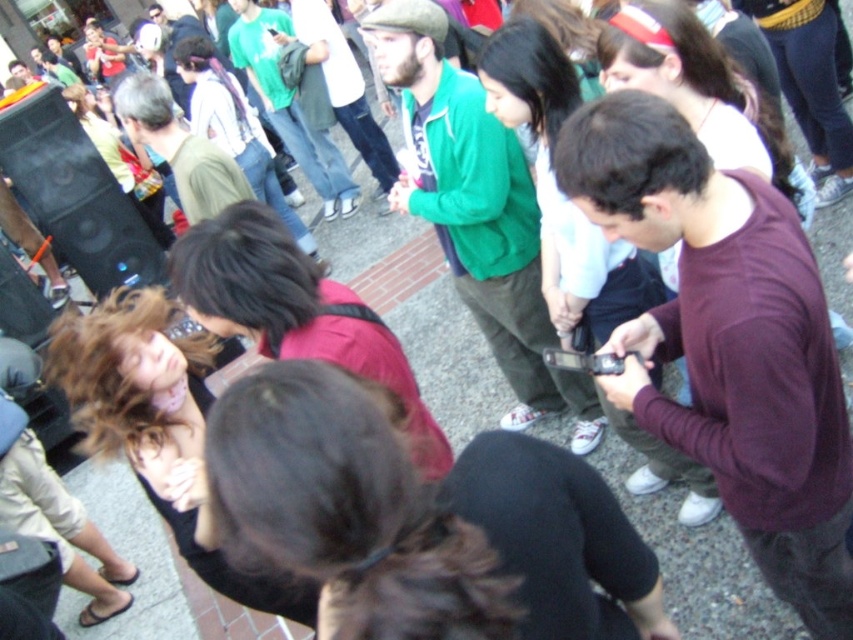
Question: Based on their relative distances, which object is farther from the maroon sweater at center?

Choices:
 (A) black matte speaker at left
 (B) green matte jacket at center

Answer: (A)

Question: Is maroon sweater at center closer to camera compared to green matte jacket at center?

Choices:
 (A) no
 (B) yes

Answer: (B)

Question: Does black matte speaker at left have a larger size compared to black matte smartphone at center?

Choices:
 (A) no
 (B) yes

Answer: (B)

Question: Which object is positioned farthest from the black matte speaker at left?

Choices:
 (A) green matte jacket at center
 (B) maroon sweater at center
 (C) black matte smartphone at center

Answer: (B)

Question: Can you confirm if green matte jacket at center is wider than black matte smartphone at center?

Choices:
 (A) yes
 (B) no

Answer: (A)

Question: Which object is positioned farthest from the black matte smartphone at center?

Choices:
 (A) black matte speaker at left
 (B) maroon sweater at center
 (C) green matte jacket at center

Answer: (A)